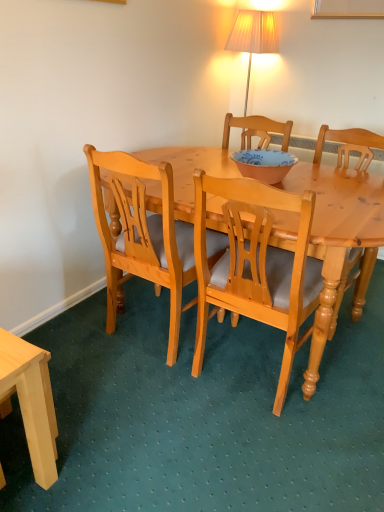
The width and height of the screenshot is (384, 512). What are the coordinates of `free space underneath light brown wood chair at center, acting as the third chair starting from the right (from a real-world perspective)` in the screenshot? It's located at (178, 334).